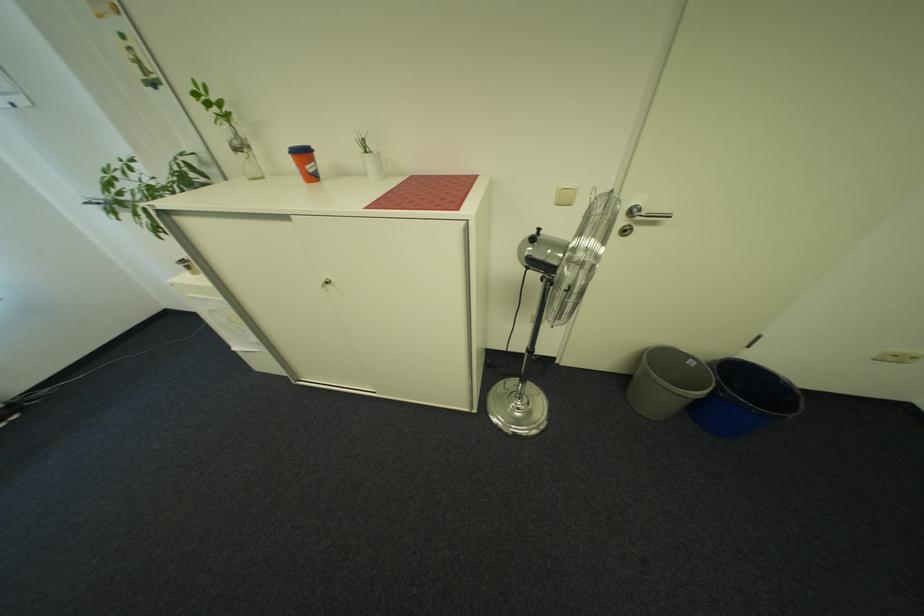
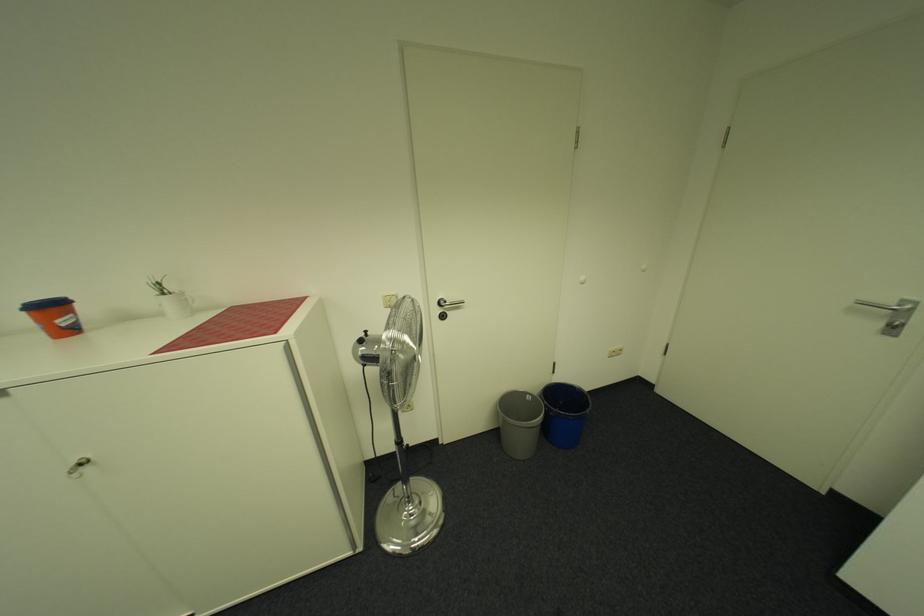
Based on the continuous images, in which direction is the camera rotating?

The rotation direction of the camera is right-up.